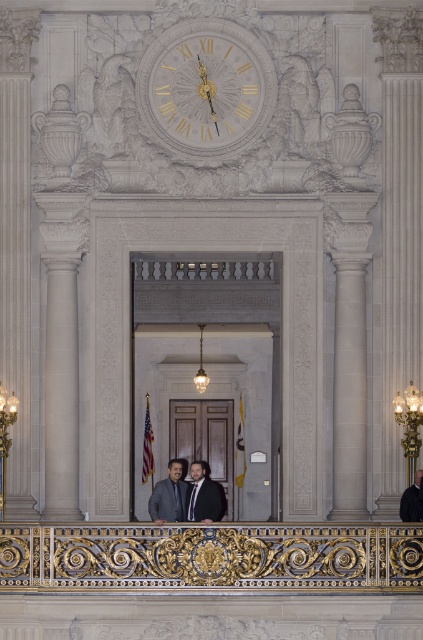
You are a photographer setting up a shot in this grand interior space. You need to ensure that the gold metallic clock at upper center and the dark gray matte business suit at center are both in frame. Based on their relative sizes, which object should you adjust your camera angle to prioritize capturing first?

The gold metallic clock at upper center might be wider than dark gray matte business suit at center, so you should prioritize capturing the gold metallic clock at upper center first to ensure it fits within the frame.

You are a photographer setting up for an event. You need to capture both the dark gray suit at center and the dark gray suit at lower right in the same frame. Which dark gray suit should you focus on first to ensure both are in the shot?

The dark gray suit at center is positioned under dark gray suit at lower right, so focusing on the dark gray suit at lower right first will ensure both are in the frame as the lower right one is above the center one.

You are standing in the grand hall and want to know how far the point marked at coordinates point (187, 492) is from your current position. Can you determine the distance?

The distance between point (187, 492) and the camera is 336.81 feet.